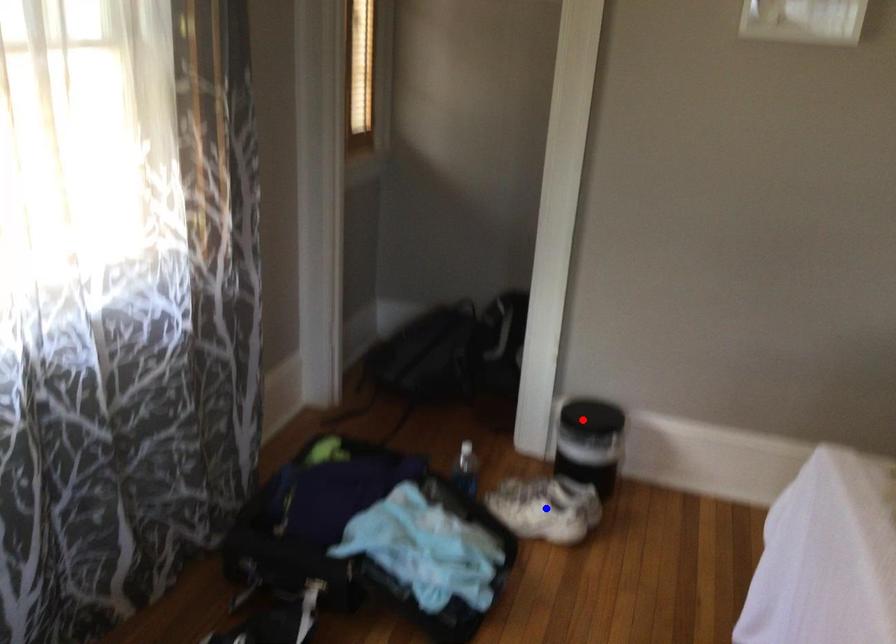
Question: In the image, two points are highlighted. Which point is nearer to the camera? Reply with the corresponding letter.

Choices:
 (A) blue point
 (B) red point

Answer: (A)